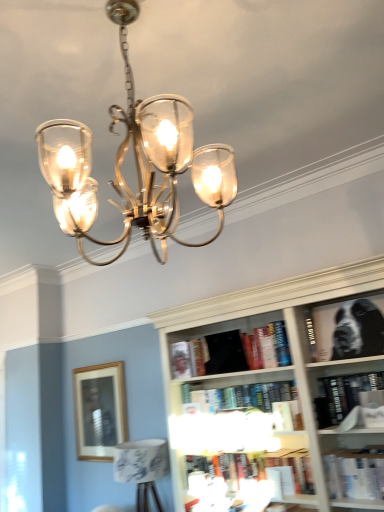
Question: Relative to hardcover book at center, which appears as the 4th book when ordered from the bottom, is hardcover book at lower center, which is the 7th book from top to bottom, in front or behind?

Choices:
 (A) front
 (B) behind

Answer: (B)

Question: From a real-world perspective, is hardcover book at lower center, which is the 7th book from top to bottom, positioned above or below hardcover book at center, which appears as the 4th book when ordered from the bottom?

Choices:
 (A) below
 (B) above

Answer: (A)

Question: Based on their relative distances, which object is farther from the wooden picture frame at center left?

Choices:
 (A) black matte bookshelf at upper right, placed as the seventh book when sorted from bottom to top
 (B) hardcover book at center, which appears as the 4th book when ordered from the bottom
 (C) white paper book at lower right, which is counted as the sixth book, starting from the top
 (D) hardcover book at center, which ranks as the 3th book in bottom-to-top order
 (E) black matte book at center, arranged as the 6th book when ordered from the bottom

Answer: (A)

Question: Estimate the real-world distances between objects in this image. Which object is closer to the polished brass chandelier at upper center?

Choices:
 (A) black matte book at center, arranged as the 6th book when ordered from the bottom
 (B) hardcover book at center, acting as the 4th book starting from the top
 (C) hardcover book at lower center, which is the 7th book from top to bottom
 (D) black matte bookshelf at upper right, placed as the seventh book when sorted from bottom to top
 (E) hardcover book at center, which ranks as the 3th book in top-to-bottom order

Answer: (D)